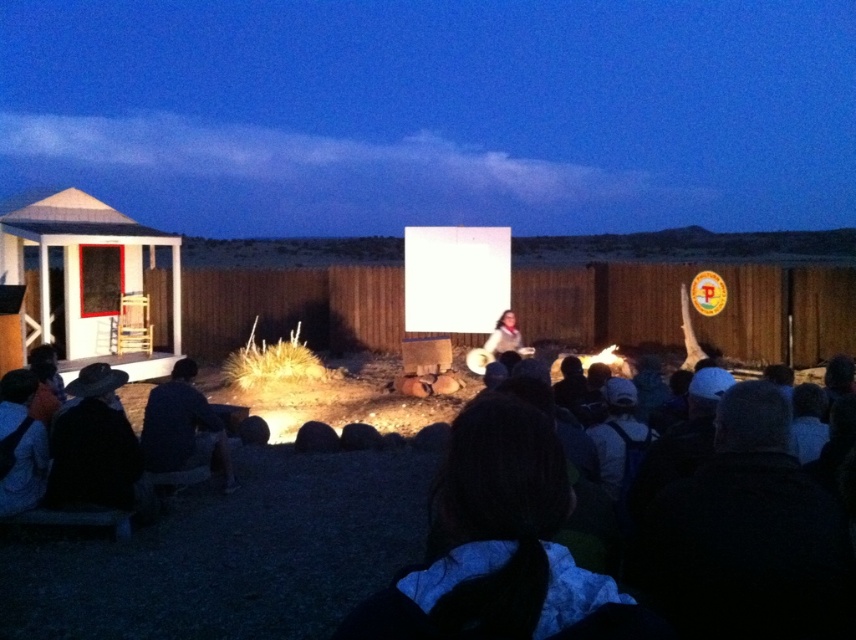
You are an event organizer at the desert gathering and need to place a decorative item between the black felt hat at lower left and the dark blue fabric at lower left. Where should you place it to ensure it is between them?

The black felt hat at lower left is positioned on the right side of dark blue fabric at lower left, so placing the decorative item between them would require placing it to the right of the dark blue fabric at lower left and to the left of the black felt hat at lower left.

You are a photographer at the event and want to capture a photo of the black felt hat at lower left without the dark blue fabric at lower left appearing in the background. Is this possible?

The black felt hat at lower left is positioned under the dark blue fabric at lower left, so the dark blue fabric would be in the background of the photo. Therefore, it is not possible to capture the black felt hat at lower left without the dark blue fabric at lower left appearing in the background.